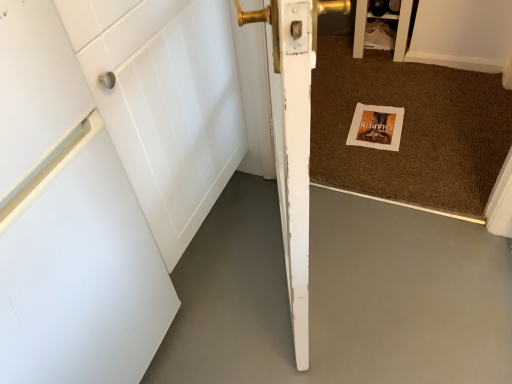
Locate an element on the screen. free point behind white paper postcard at center is located at coordinates (364, 94).